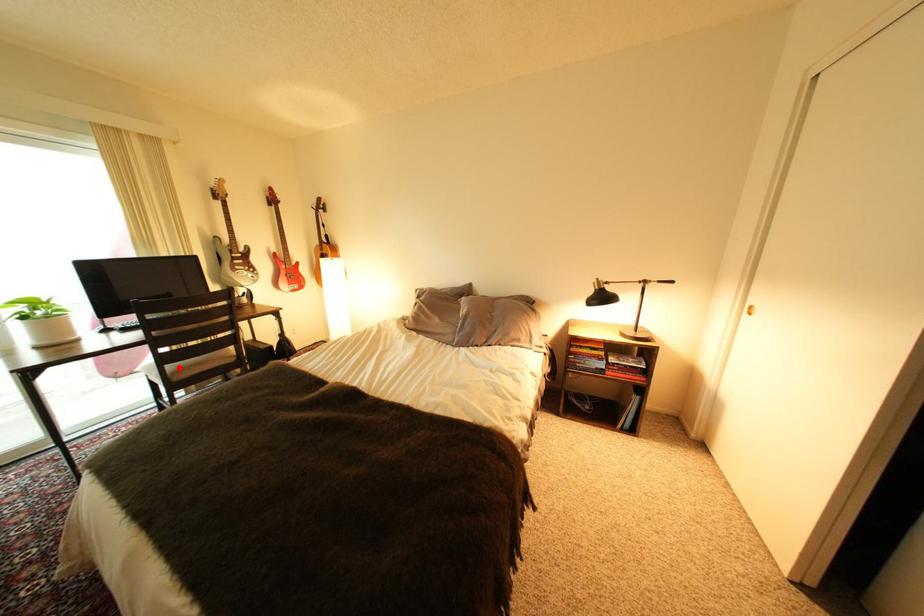
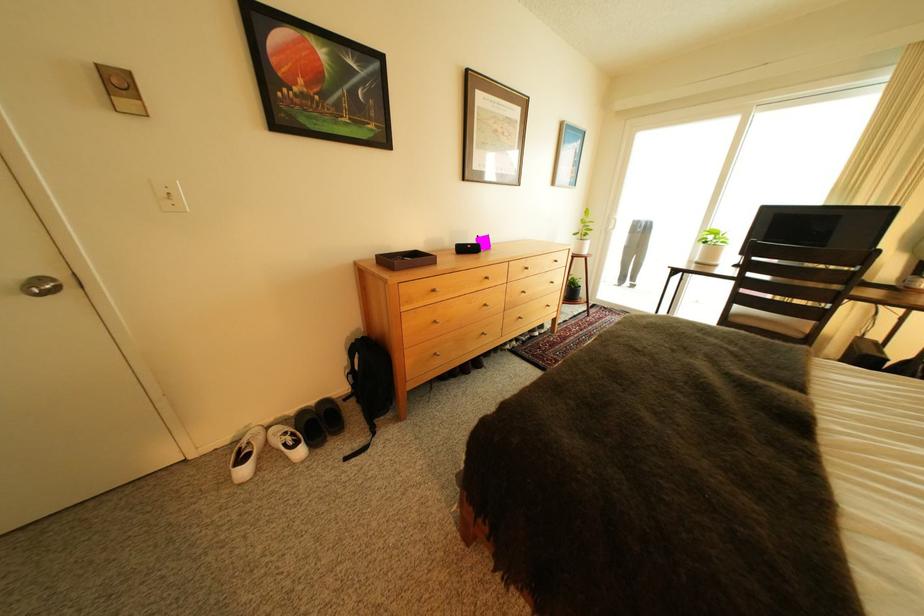
Where in the second image is the point corresponding to the highlighted location from the first image?

(748, 307)